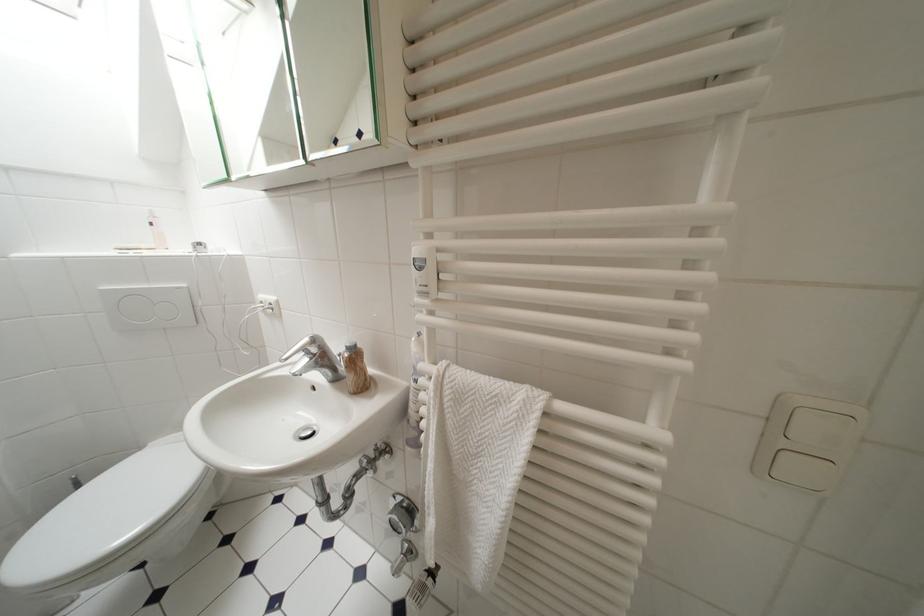
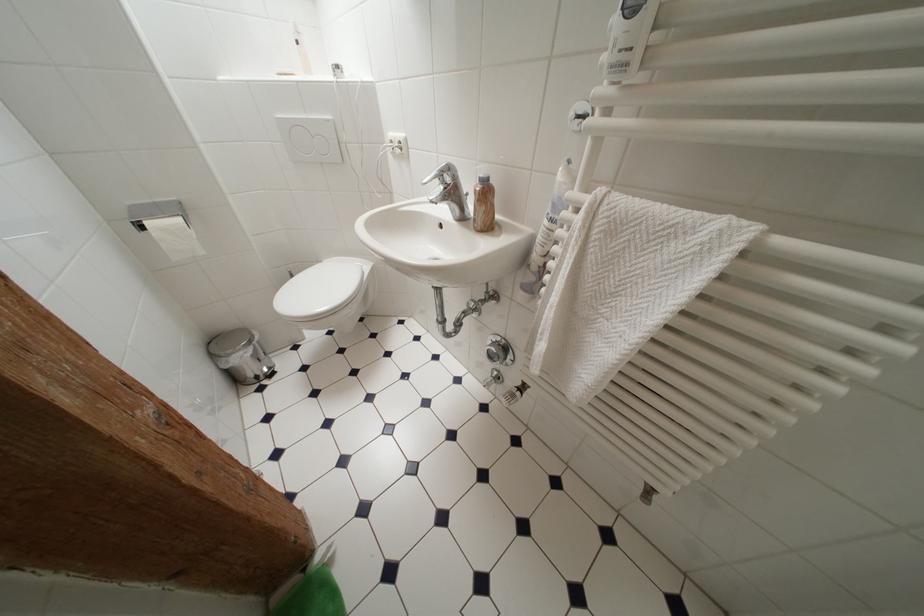
Where in the second image is the point corresponding to (x=322, y=342) from the first image?

(456, 171)